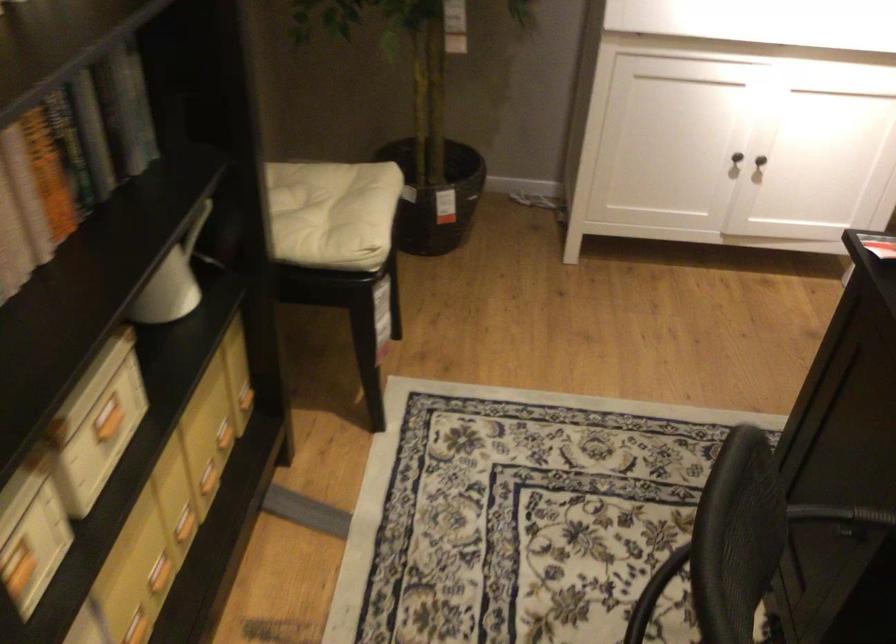
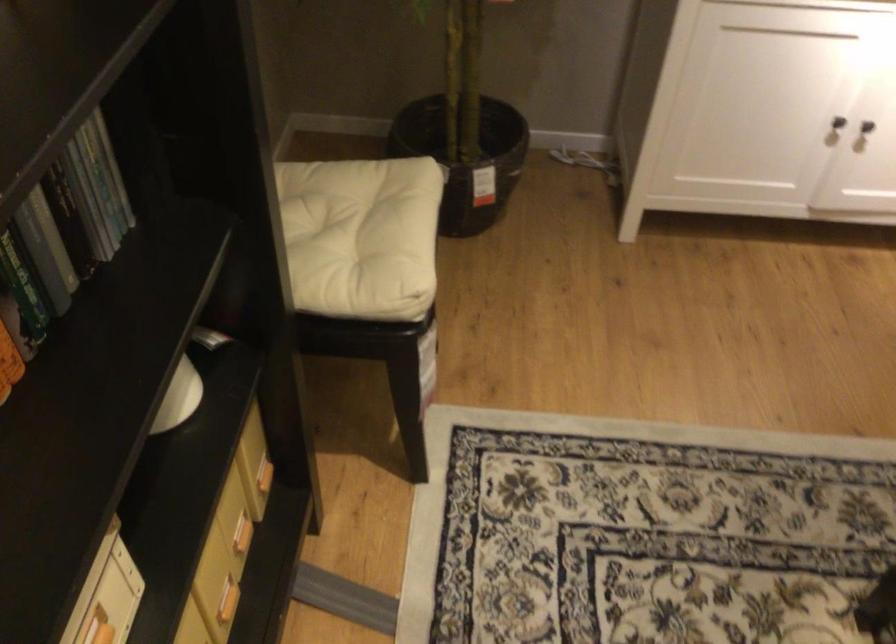
Find the pixel in the second image that matches (330,214) in the first image.

(355, 234)